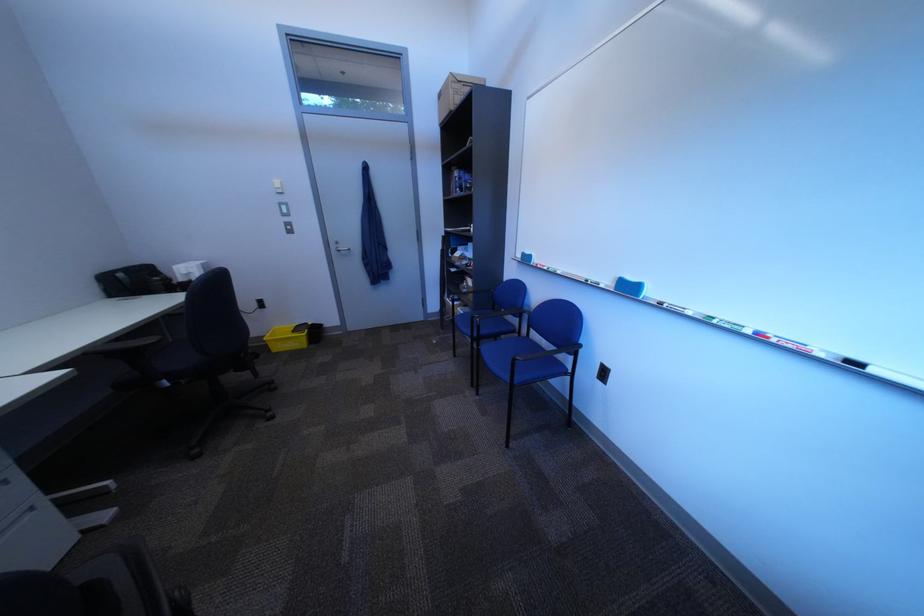
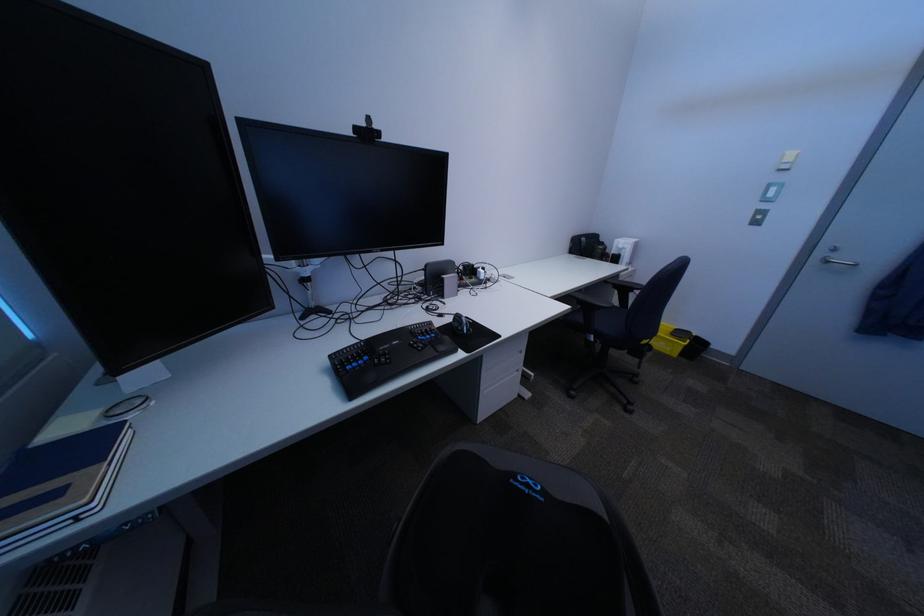
The point at (197, 282) is marked in the first image. Where is the corresponding point in the second image?

(628, 254)